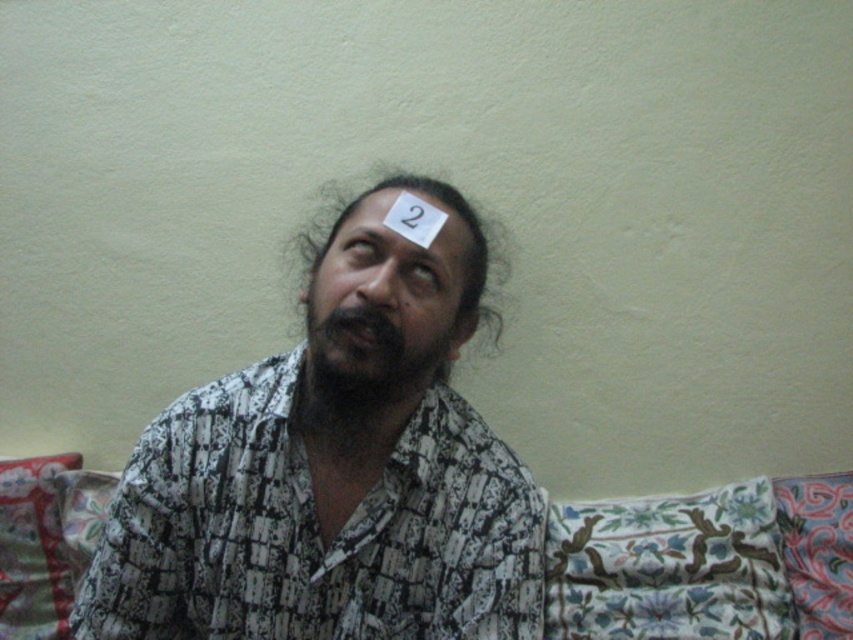
Which is behind, point (744, 506) or point (369, 380)?

The point (744, 506) is more distant.

Is floral fabric pillow at lower right wider than black fuzzy beard at center?

Yes, floral fabric pillow at lower right is wider than black fuzzy beard at center.

Which is in front, point (639, 570) or point (426, 342)?

Point (426, 342) is more forward.

This screenshot has width=853, height=640. I want to click on floral fabric pillow at lower right, so click(x=668, y=566).

Can you confirm if matte black face at center is bigger than white paper at center?

Yes.

Does point (305, 317) come farther from viewer compared to point (415, 195)?

Yes, point (305, 317) is farther from viewer.

Identify the location of matte black face at center. (432, 198).

Does white printed shirt at center appear on the right side of brown hair at upper center?

In fact, white printed shirt at center is to the left of brown hair at upper center.

Does white printed shirt at center lie in front of brown hair at upper center?

Yes, it is.

Who is more forward, (389, 340) or (375, 228)?

Point (389, 340) is more forward.

The width and height of the screenshot is (853, 640). In order to click on white printed shirt at center in this screenshot , I will do `click(334, 474)`.